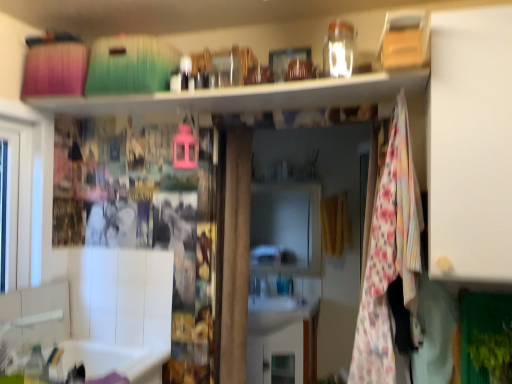
Question: Is the position of white matte cabinet at right more distant than that of floral fabric blanket at center-right?

Choices:
 (A) yes
 (B) no

Answer: (B)

Question: Does white matte cabinet at right have a lesser height compared to floral fabric blanket at center-right?

Choices:
 (A) yes
 (B) no

Answer: (A)

Question: Is white matte cabinet at right looking in the opposite direction of floral fabric blanket at center-right?

Choices:
 (A) no
 (B) yes

Answer: (A)

Question: Does white matte cabinet at right have a lesser width compared to floral fabric blanket at center-right?

Choices:
 (A) yes
 (B) no

Answer: (B)

Question: Can you confirm if white matte cabinet at right is taller than floral fabric blanket at center-right?

Choices:
 (A) yes
 (B) no

Answer: (B)

Question: From a real-world perspective, is white matte cabinet at right on top of floral fabric blanket at center-right?

Choices:
 (A) yes
 (B) no

Answer: (A)

Question: Does white matte cabinet at right lie in front of white glossy cabinet at center?

Choices:
 (A) no
 (B) yes

Answer: (B)

Question: Considering the relative sizes of white matte cabinet at right and white glossy cabinet at center in the image provided, is white matte cabinet at right bigger than white glossy cabinet at center?

Choices:
 (A) yes
 (B) no

Answer: (A)

Question: From the image's perspective, is white matte cabinet at right on top of white glossy cabinet at center?

Choices:
 (A) yes
 (B) no

Answer: (A)

Question: Considering the relative sizes of white matte cabinet at right and white glossy cabinet at center in the image provided, is white matte cabinet at right smaller than white glossy cabinet at center?

Choices:
 (A) no
 (B) yes

Answer: (A)

Question: Is white matte cabinet at right oriented away from white glossy cabinet at center?

Choices:
 (A) no
 (B) yes

Answer: (A)

Question: Is white matte cabinet at right behind white glossy cabinet at center?

Choices:
 (A) yes
 (B) no

Answer: (B)

Question: Considering the relative sizes of white glossy cabinet at center and floral fabric blanket at center-right in the image provided, is white glossy cabinet at center shorter than floral fabric blanket at center-right?

Choices:
 (A) no
 (B) yes

Answer: (B)